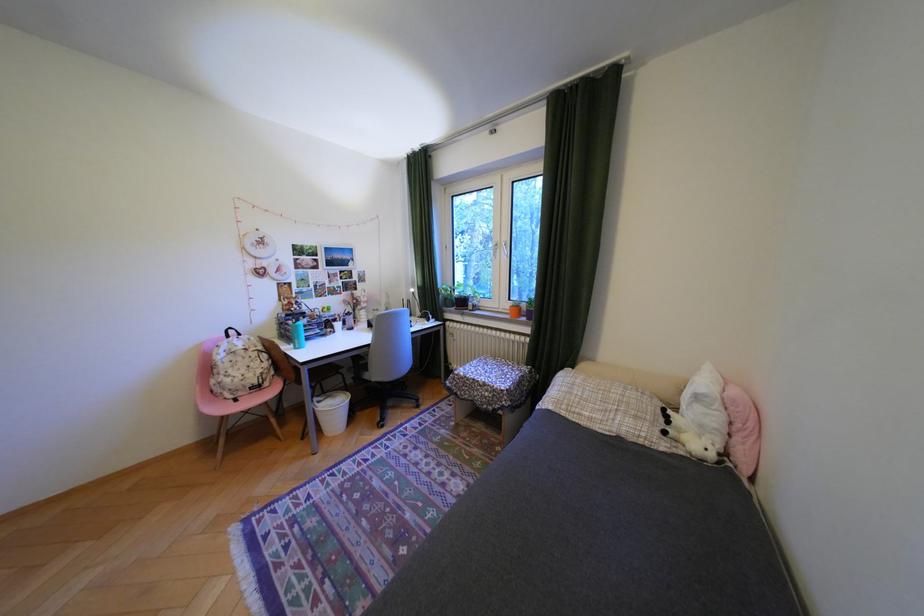
This screenshot has height=616, width=924. Identify the location of window handle. (517, 254).